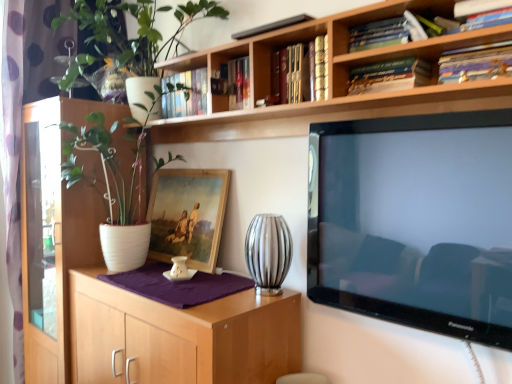
Question: Can you confirm if white matte pot at upper left is smaller than hardcover books at upper center, the 3th book viewed from the right?

Choices:
 (A) no
 (B) yes

Answer: (A)

Question: Is white matte pot at upper left bigger than hardcover books at upper center, the 3th book viewed from the right?

Choices:
 (A) no
 (B) yes

Answer: (B)

Question: Can you confirm if white matte pot at upper left is taller than hardcover books at upper center, the 3th book viewed from the right?

Choices:
 (A) yes
 (B) no

Answer: (A)

Question: Is white matte pot at upper left next to hardcover books at upper center, which appears as the 2th book when viewed from the left?

Choices:
 (A) no
 (B) yes

Answer: (A)

Question: Can you confirm if white matte pot at upper left is positioned to the left of hardcover books at upper center, which appears as the 2th book when viewed from the left?

Choices:
 (A) no
 (B) yes

Answer: (B)

Question: In terms of height, does wooden framed painting at center look taller or shorter compared to hardcover book at upper right, marked as the first book in a right-to-left arrangement?

Choices:
 (A) tall
 (B) short

Answer: (A)

Question: From a real-world perspective, is wooden framed painting at center physically located above or below hardcover book at upper right, marked as the first book in a right-to-left arrangement?

Choices:
 (A) above
 (B) below

Answer: (B)

Question: From the image's perspective, relative to hardcover book at upper right, which is counted as the 4th book, starting from the left, is wooden framed painting at center above or below?

Choices:
 (A) above
 (B) below

Answer: (B)

Question: Based on their sizes in the image, would you say wooden framed painting at center is bigger or smaller than hardcover book at upper right, marked as the first book in a right-to-left arrangement?

Choices:
 (A) small
 (B) big

Answer: (B)

Question: Visually, is wooden framed painting at center positioned to the left or to the right of hardcover book at upper center, which is the 2th book from right to left?

Choices:
 (A) right
 (B) left

Answer: (B)

Question: In terms of height, does wooden framed painting at center look taller or shorter compared to hardcover book at upper center, which is the 2th book from right to left?

Choices:
 (A) tall
 (B) short

Answer: (A)

Question: From the image's perspective, is wooden framed painting at center above or below hardcover book at upper center, the 3th book from the left?

Choices:
 (A) above
 (B) below

Answer: (B)

Question: From a real-world perspective, is wooden framed painting at center positioned above or below hardcover book at upper center, the 3th book from the left?

Choices:
 (A) below
 (B) above

Answer: (A)

Question: Would you say wooden bookshelf at upper center is to the left or to the right of hardcover book at upper center, the fourth book when ordered from right to left, in the picture?

Choices:
 (A) left
 (B) right

Answer: (A)

Question: From a real-world perspective, is wooden bookshelf at upper center physically located above or below hardcover book at upper center, the fourth book when ordered from right to left?

Choices:
 (A) below
 (B) above

Answer: (B)